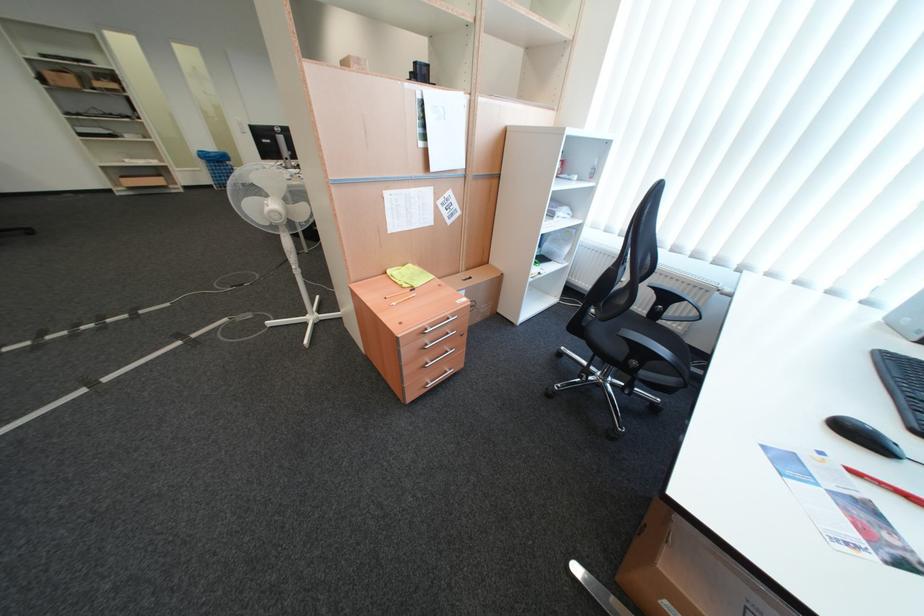
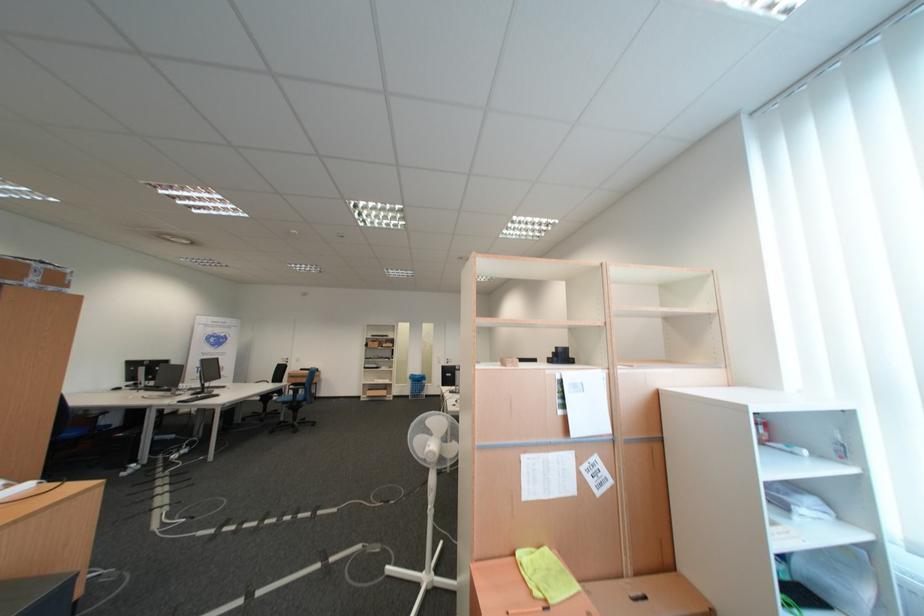
The point at (226,182) is marked in the first image. Where is the corresponding point in the second image?

(422, 394)